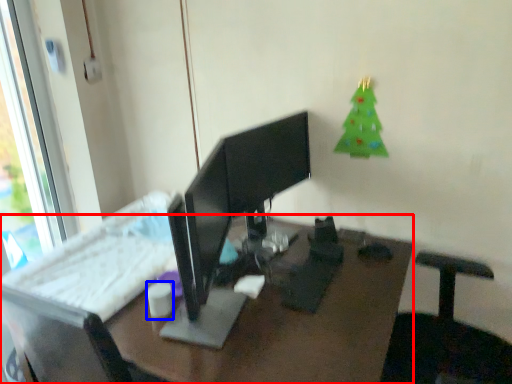
Question: Among these objects, which one is nearest to the camera, desk (highlighted by a red box) or tableware (highlighted by a blue box)?

Choices:
 (A) desk
 (B) tableware

Answer: (A)